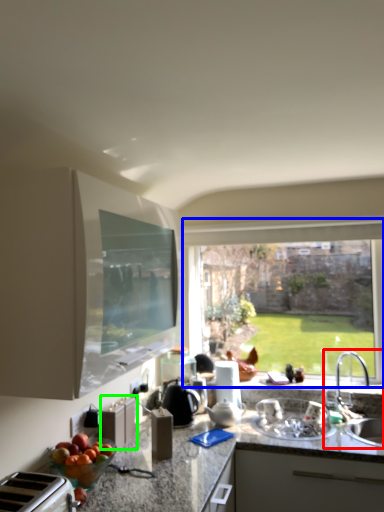
Question: Which object is positioned farthest from sink (highlighted by a red box)? Select from window (highlighted by a blue box) and cabinetry (highlighted by a green box).

Choices:
 (A) window
 (B) cabinetry

Answer: (B)